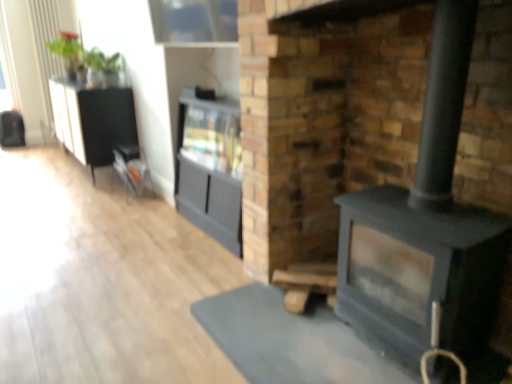
Question: Are matte gray cabinet at center, the 2th entertainment center in the back-to-front sequence, and matte black fireplace at center located far from each other?

Choices:
 (A) yes
 (B) no

Answer: (B)

Question: Considering the relative sizes of matte gray cabinet at center, acting as the 1th entertainment center starting from the right, and matte black fireplace at center in the image provided, is matte gray cabinet at center, acting as the 1th entertainment center starting from the right, shorter than matte black fireplace at center?

Choices:
 (A) yes
 (B) no

Answer: (A)

Question: Can you confirm if matte gray cabinet at center, acting as the 1th entertainment center starting from the right, is bigger than matte black fireplace at center?

Choices:
 (A) no
 (B) yes

Answer: (A)

Question: Considering the relative positions of matte gray cabinet at center, arranged as the first entertainment center when viewed from the front, and matte black fireplace at center in the image provided, is matte gray cabinet at center, arranged as the first entertainment center when viewed from the front, to the right of matte black fireplace at center from the viewer's perspective?

Choices:
 (A) yes
 (B) no

Answer: (B)

Question: From a real-world perspective, is matte gray cabinet at center, the 2th entertainment center in the back-to-front sequence, below matte black fireplace at center?

Choices:
 (A) no
 (B) yes

Answer: (B)

Question: From the image's perspective, is matte black fireplace at center located above or below black textured cabinet at left, marked as the 1th entertainment center in a left-to-right arrangement?

Choices:
 (A) below
 (B) above

Answer: (A)

Question: Is point (460, 158) positioned closer to the camera than point (134, 109)?

Choices:
 (A) closer
 (B) farther

Answer: (A)

Question: Do you think matte black fireplace at center is within black textured cabinet at left, marked as the 1th entertainment center in a left-to-right arrangement, or outside of it?

Choices:
 (A) outside
 (B) inside

Answer: (A)

Question: In terms of height, does matte black fireplace at center look taller or shorter compared to black textured cabinet at left, which ranks as the 1th entertainment center in back-to-front order?

Choices:
 (A) short
 (B) tall

Answer: (B)

Question: Is matte gray cabinet at center, the second entertainment center positioned from the left, taller or shorter than matte black fireplace at center?

Choices:
 (A) short
 (B) tall

Answer: (A)

Question: Based on their sizes in the image, would you say matte gray cabinet at center, the second entertainment center positioned from the left, is bigger or smaller than matte black fireplace at center?

Choices:
 (A) small
 (B) big

Answer: (A)

Question: In terms of width, does matte gray cabinet at center, the 2th entertainment center in the back-to-front sequence, look wider or thinner when compared to matte black fireplace at center?

Choices:
 (A) wide
 (B) thin

Answer: (B)

Question: Is point (241, 163) closer or farther from the camera than point (242, 81)?

Choices:
 (A) farther
 (B) closer

Answer: (A)

Question: From a real-world perspective, relative to metallic silver magazine rack at left, is white glossy radiator at upper left vertically above or below?

Choices:
 (A) above
 (B) below

Answer: (A)

Question: Is point (42, 89) positioned closer to the camera than point (133, 170)?

Choices:
 (A) closer
 (B) farther

Answer: (B)